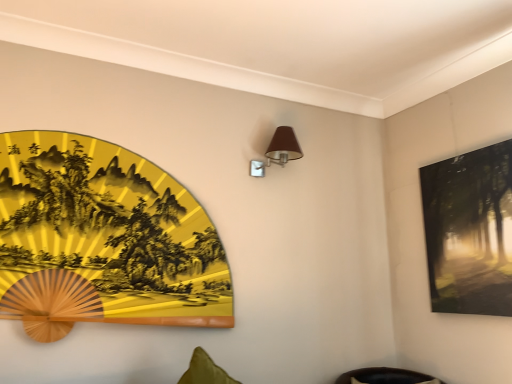
Measure the distance between point (301, 151) and camera.

The depth of point (301, 151) is 2.40 meters.

What do you see at coordinates (106, 235) in the screenshot? This screenshot has height=384, width=512. I see `gold lacquered fan at left, the 2th picture frame from the right` at bounding box center [106, 235].

The height and width of the screenshot is (384, 512). I want to click on matte black painting at upper right, which is the first picture frame from right to left, so click(470, 231).

Considering the relative sizes of brown fabric table lamp at upper center and gold lacquered fan at left, the 1th picture frame from the left, in the image provided, is brown fabric table lamp at upper center smaller than gold lacquered fan at left, the 1th picture frame from the left,?

Yes, brown fabric table lamp at upper center is smaller than gold lacquered fan at left, the 1th picture frame from the left.

Is brown fabric table lamp at upper center turned away from gold lacquered fan at left, the 2th picture frame from the right?

That's not correct — brown fabric table lamp at upper center is not looking away from gold lacquered fan at left, the 2th picture frame from the right.

Consider the image. Is brown fabric table lamp at upper center in contact with gold lacquered fan at left, the 2th picture frame from the right?

No, brown fabric table lamp at upper center is not with gold lacquered fan at left, the 2th picture frame from the right.

Can we say brown fabric table lamp at upper center lies outside gold lacquered fan at left, the 2th picture frame from the right?

Absolutely, brown fabric table lamp at upper center is external to gold lacquered fan at left, the 2th picture frame from the right.

Does brown fabric table lamp at upper center come behind matte black painting at upper right, which is the first picture frame from right to left?

Yes, the depth of brown fabric table lamp at upper center is greater than that of matte black painting at upper right, which is the first picture frame from right to left.

Considering the relative sizes of brown fabric table lamp at upper center and matte black painting at upper right, placed as the second picture frame when sorted from left to right, in the image provided, is brown fabric table lamp at upper center smaller than matte black painting at upper right, placed as the second picture frame when sorted from left to right,?

Indeed, brown fabric table lamp at upper center has a smaller size compared to matte black painting at upper right, placed as the second picture frame when sorted from left to right.

Which object is thinner, brown fabric table lamp at upper center or matte black painting at upper right, which is the first picture frame from right to left?

Thinner between the two is matte black painting at upper right, which is the first picture frame from right to left.

Does brown fabric table lamp at upper center turn towards matte black painting at upper right, which is the first picture frame from right to left?

No, brown fabric table lamp at upper center is not oriented towards matte black painting at upper right, which is the first picture frame from right to left.

From a real-world perspective, is matte black painting at upper right, placed as the second picture frame when sorted from left to right, above or below brown fabric table lamp at upper center?

matte black painting at upper right, placed as the second picture frame when sorted from left to right, is situated lower than brown fabric table lamp at upper center in the real world.

Considering the relative sizes of matte black painting at upper right, placed as the second picture frame when sorted from left to right, and brown fabric table lamp at upper center in the image provided, is matte black painting at upper right, placed as the second picture frame when sorted from left to right, smaller than brown fabric table lamp at upper center?

Incorrect, matte black painting at upper right, placed as the second picture frame when sorted from left to right, is not smaller in size than brown fabric table lamp at upper center.

From their relative heights in the image, would you say matte black painting at upper right, placed as the second picture frame when sorted from left to right, is taller or shorter than brown fabric table lamp at upper center?

In the image, matte black painting at upper right, placed as the second picture frame when sorted from left to right, appears to be taller than brown fabric table lamp at upper center.

Does gold lacquered fan at left, the 1th picture frame from the left, lie in front of brown fabric table lamp at upper center?

Yes, it is.

Is gold lacquered fan at left, the 2th picture frame from the right, inside the boundaries of brown fabric table lamp at upper center, or outside?

gold lacquered fan at left, the 2th picture frame from the right, is spatially situated outside brown fabric table lamp at upper center.

Based on the photo, considering the positions of objects gold lacquered fan at left, the 1th picture frame from the left, and brown fabric table lamp at upper center in the image provided, who is more to the left, gold lacquered fan at left, the 1th picture frame from the left, or brown fabric table lamp at upper center?

gold lacquered fan at left, the 1th picture frame from the left, is more to the left.

From a real-world perspective, which is physically above, gold lacquered fan at left, the 2th picture frame from the right, or matte black painting at upper right, placed as the second picture frame when sorted from left to right?

From a 3D spatial view, matte black painting at upper right, placed as the second picture frame when sorted from left to right, is above.

From the image's perspective, which is below, gold lacquered fan at left, the 1th picture frame from the left, or matte black painting at upper right, which is the first picture frame from right to left?

matte black painting at upper right, which is the first picture frame from right to left, appears lower in the image.

Which of these two, gold lacquered fan at left, the 2th picture frame from the right, or matte black painting at upper right, placed as the second picture frame when sorted from left to right, is wider?

With larger width is gold lacquered fan at left, the 2th picture frame from the right.

Between matte black painting at upper right, placed as the second picture frame when sorted from left to right, and gold lacquered fan at left, the 1th picture frame from the left, which one has smaller width?

Thinner between the two is matte black painting at upper right, placed as the second picture frame when sorted from left to right.

Is matte black painting at upper right, placed as the second picture frame when sorted from left to right, placed right next to gold lacquered fan at left, the 1th picture frame from the left?

No, matte black painting at upper right, placed as the second picture frame when sorted from left to right, is not with gold lacquered fan at left, the 1th picture frame from the left.

What's the angular difference between matte black painting at upper right, which is the first picture frame from right to left, and gold lacquered fan at left, the 1th picture frame from the left,'s facing directions?

There is a 90.1-degree angle between the facing directions of matte black painting at upper right, which is the first picture frame from right to left, and gold lacquered fan at left, the 1th picture frame from the left.

From the image's perspective, between matte black painting at upper right, placed as the second picture frame when sorted from left to right, and gold lacquered fan at left, the 2th picture frame from the right, which one is located above?

From the image's view, gold lacquered fan at left, the 2th picture frame from the right, is above.

At what (x,y) coordinates should I click in order to perform the action: click on the 2nd picture frame in front of the brown fabric table lamp at upper center, starting your count from the anchor. Please return your answer as a coordinate pair (x, y). Looking at the image, I should click on (106, 235).

From a real-world perspective, starting from the brown fabric table lamp at upper center, which picture frame is the 1st one below it? Please provide its 2D coordinates.

[(470, 231)]

Which object lies further to the anchor point gold lacquered fan at left, the 1th picture frame from the left, brown fabric table lamp at upper center or matte black painting at upper right, placed as the second picture frame when sorted from left to right?

Among the two, matte black painting at upper right, placed as the second picture frame when sorted from left to right, is located further to gold lacquered fan at left, the 1th picture frame from the left.

Based on their spatial positions, is matte black painting at upper right, which is the first picture frame from right to left, or gold lacquered fan at left, the 2th picture frame from the right, further from brown fabric table lamp at upper center?

matte black painting at upper right, which is the first picture frame from right to left, lies further to brown fabric table lamp at upper center than the other object.

Based on their spatial positions, is gold lacquered fan at left, the 1th picture frame from the left, or brown fabric table lamp at upper center closer to matte black painting at upper right, which is the first picture frame from right to left?

Among the two, brown fabric table lamp at upper center is located nearer to matte black painting at upper right, which is the first picture frame from right to left.

Considering their positions, is matte black painting at upper right, which is the first picture frame from right to left, positioned further to gold lacquered fan at left, the 1th picture frame from the left, than brown fabric table lamp at upper center?

The object further to gold lacquered fan at left, the 1th picture frame from the left, is matte black painting at upper right, which is the first picture frame from right to left.

Based on their spatial positions, is gold lacquered fan at left, the 1th picture frame from the left, or matte black painting at upper right, which is the first picture frame from right to left, closer to brown fabric table lamp at upper center?

Among the two, gold lacquered fan at left, the 1th picture frame from the left, is located nearer to brown fabric table lamp at upper center.

Estimate the real-world distances between objects in this image. Which object is closer to matte black painting at upper right, which is the first picture frame from right to left, brown fabric table lamp at upper center or gold lacquered fan at left, the 2th picture frame from the right?

The object closer to matte black painting at upper right, which is the first picture frame from right to left, is brown fabric table lamp at upper center.

You are a GUI agent. You are given a task and a screenshot of the screen. Output one action in this format:
    pyautogui.click(x=<x>, y=<y>)
    Task: Click on the table lamp between gold lacquered fan at left, the 1th picture frame from the left, and matte black painting at upper right, which is the first picture frame from right to left, in the horizontal direction
    
    Given the screenshot: What is the action you would take?
    pyautogui.click(x=278, y=151)